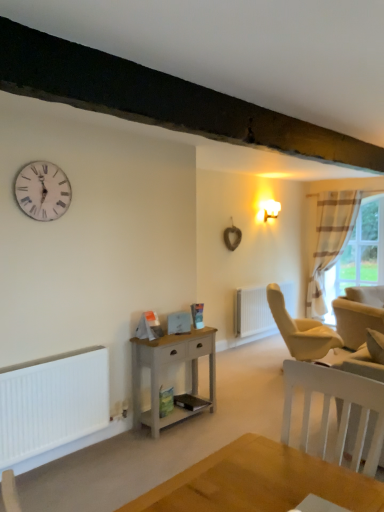
Locate an element on the screen. vacant area located to the right-hand side of light gray wood nightstand at center is located at coordinates (229, 417).